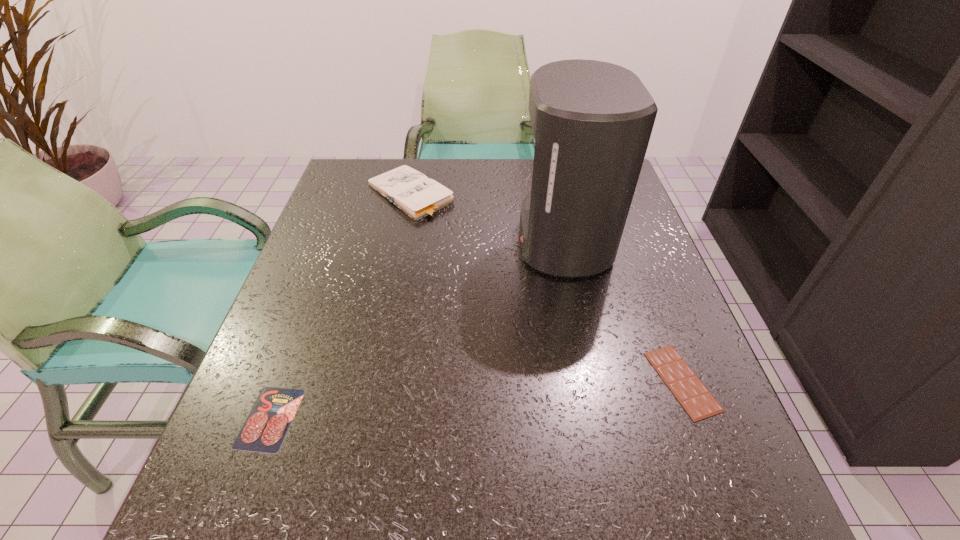
You are a GUI agent. You are given a task and a screenshot of the screen. Output one action in this format:
    pyautogui.click(x=<x>, y=<y>)
    Task: Click on the coffee maker located in the far edge section of the desktop
    The height and width of the screenshot is (540, 960).
    Given the screenshot: What is the action you would take?
    pyautogui.click(x=592, y=121)

Locate an element on the screen. This screenshot has width=960, height=540. notebook present at the far edge is located at coordinates (419, 197).

In order to click on notebook that is at the left edge in this screenshot , I will do `click(419, 197)`.

The image size is (960, 540). I want to click on salami that is at the left edge, so click(x=267, y=424).

Identify the location of coffee maker present at the right edge. (592, 121).

The image size is (960, 540). I want to click on chocolate bar that is at the right edge, so click(x=698, y=402).

Image resolution: width=960 pixels, height=540 pixels. I want to click on object that is at the far left corner, so click(419, 197).

The image size is (960, 540). Find the location of `object at the far right corner`. object at the far right corner is located at coordinates (592, 121).

Locate an element on the screen. The height and width of the screenshot is (540, 960). vacant area at the far edge is located at coordinates (488, 201).

Find the location of a particular element. vacant space at the left edge of the desktop is located at coordinates (265, 456).